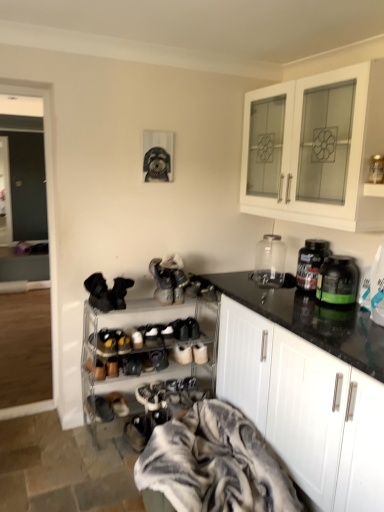
Question: From the image's perspective, is white glossy cabinet at upper right, which appears as the first cabinetry when viewed from the top, under green plastic jar at right, placed as the first bottle when sorted from front to back?

Choices:
 (A) no
 (B) yes

Answer: (A)

Question: Can you confirm if white glossy cabinet at upper right, which appears as the first cabinetry when viewed from the top, is smaller than green plastic jar at right, placed as the first bottle when sorted from front to back?

Choices:
 (A) yes
 (B) no

Answer: (B)

Question: Is green plastic jar at right, the second bottle from the back, surrounded by white glossy cabinet at upper right, which appears as the first cabinetry when viewed from the top?

Choices:
 (A) yes
 (B) no

Answer: (B)

Question: Is white glossy cabinet at upper right, which ranks as the 2th cabinetry in bottom-to-top order, shorter than green plastic jar at right, placed as the first bottle when sorted from front to back?

Choices:
 (A) no
 (B) yes

Answer: (A)

Question: Is the depth of white glossy cabinet at upper right, which appears as the first cabinetry when viewed from the top, less than that of green plastic jar at right, the second bottle from the back?

Choices:
 (A) yes
 (B) no

Answer: (A)

Question: Would you say brown suede shoes at lower center, marked as the fourth footwear in a right-to-left arrangement, is to the left or to the right of white suede shoe at lower center, the 6th shoe from the top, in the picture?

Choices:
 (A) left
 (B) right

Answer: (A)

Question: In terms of height, does brown suede shoes at lower center, which ranks as the second footwear in left-to-right order, look taller or shorter compared to white suede shoe at lower center, the 6th shoe from the top?

Choices:
 (A) short
 (B) tall

Answer: (A)

Question: Considering their positions, is brown suede shoes at lower center, which ranks as the second footwear in left-to-right order, located in front of or behind white suede shoe at lower center, the 6th shoe from the top?

Choices:
 (A) front
 (B) behind

Answer: (A)

Question: Does point (119, 396) appear closer or farther from the camera than point (153, 392)?

Choices:
 (A) closer
 (B) farther

Answer: (A)

Question: Is green plastic jar at right, placed as the first bottle when sorted from front to back, taller or shorter than transparent glass jar at upper right?

Choices:
 (A) tall
 (B) short

Answer: (B)

Question: Is green plastic jar at right, the second bottle from the back, inside or outside of transparent glass jar at upper right?

Choices:
 (A) inside
 (B) outside

Answer: (B)

Question: Is green plastic jar at right, placed as the first bottle when sorted from front to back, to the left or to the right of transparent glass jar at upper right in the image?

Choices:
 (A) left
 (B) right

Answer: (B)

Question: Relative to transparent glass jar at upper right, is green plastic jar at right, placed as the first bottle when sorted from front to back, in front or behind?

Choices:
 (A) front
 (B) behind

Answer: (A)

Question: Is black suede shoes at lower center, marked as the 1th footwear in a bottom-to-top arrangement, situated inside black matte shoe at center, the 5th shoe from the bottom, or outside?

Choices:
 (A) outside
 (B) inside

Answer: (A)

Question: Based on their sizes in the image, would you say black suede shoes at lower center, acting as the fifth footwear starting from the top, is bigger or smaller than black matte shoe at center, the 5th shoe from the bottom?

Choices:
 (A) small
 (B) big

Answer: (B)